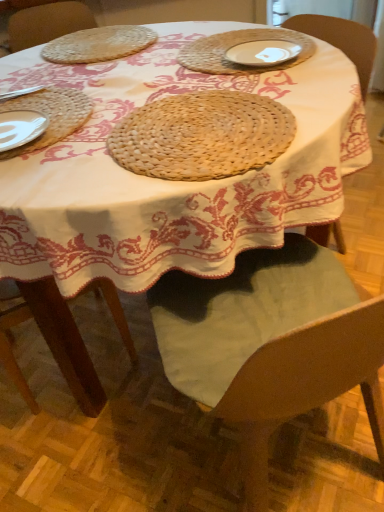
Where is `free space in front of woven straw placemat at upper left, the first pie from the back`? The image size is (384, 512). free space in front of woven straw placemat at upper left, the first pie from the back is located at coordinates (92, 76).